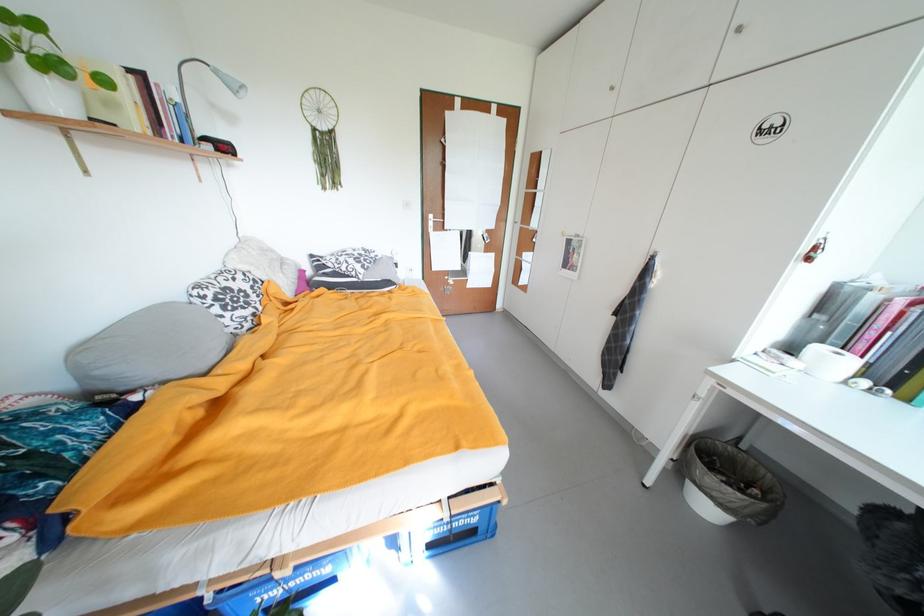
In order to click on blue plastic crate in this screenshot , I will do `click(460, 531)`.